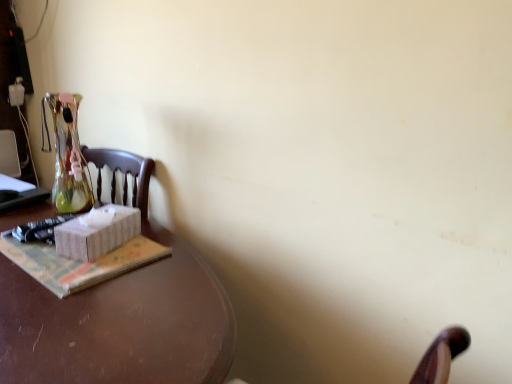
Locate an element on the screen. Image resolution: width=512 pixels, height=384 pixels. unoccupied region to the right of white wicker box at left is located at coordinates (166, 252).